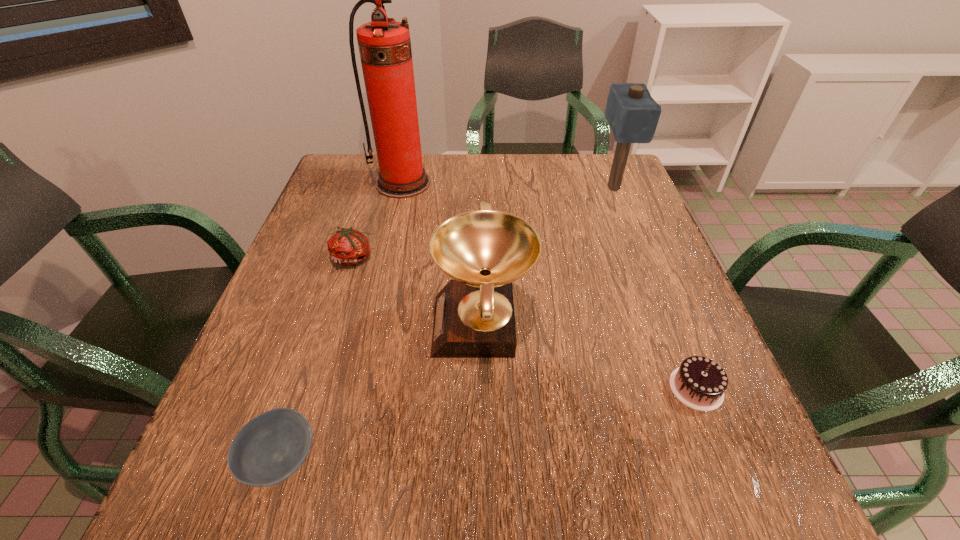
Locate which object is the third closest to the chocolate cake. Please provide its 2D coordinates. Your answer should be formatted as a tuple, i.e. [(x, y)], where the tuple contains the x and y coordinates of a point satisfying the conditions above.

[(267, 450)]

Find the location of a particular element. This screenshot has height=540, width=960. object that is the third closest to the third farthest object is located at coordinates (267, 450).

Locate an element on the screen. The height and width of the screenshot is (540, 960). vacant space that satisfies the following two spatial constraints: 1. on the back side of the chocolate cake; 2. on the right side of the bowl is located at coordinates (304, 388).

The width and height of the screenshot is (960, 540). I want to click on free location that satisfies the following two spatial constraints: 1. at the discharge end of the tallest object; 2. on the right side of the mallet, so click(x=402, y=188).

The width and height of the screenshot is (960, 540). I want to click on vacant position in the image that satisfies the following two spatial constraints: 1. on the back side of the nearest object; 2. on the right side of the third farthest object, so click(x=347, y=258).